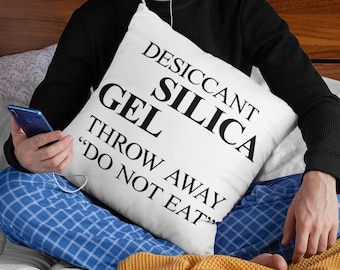
The image size is (340, 270). Identify the location of wood floor. (28, 35).